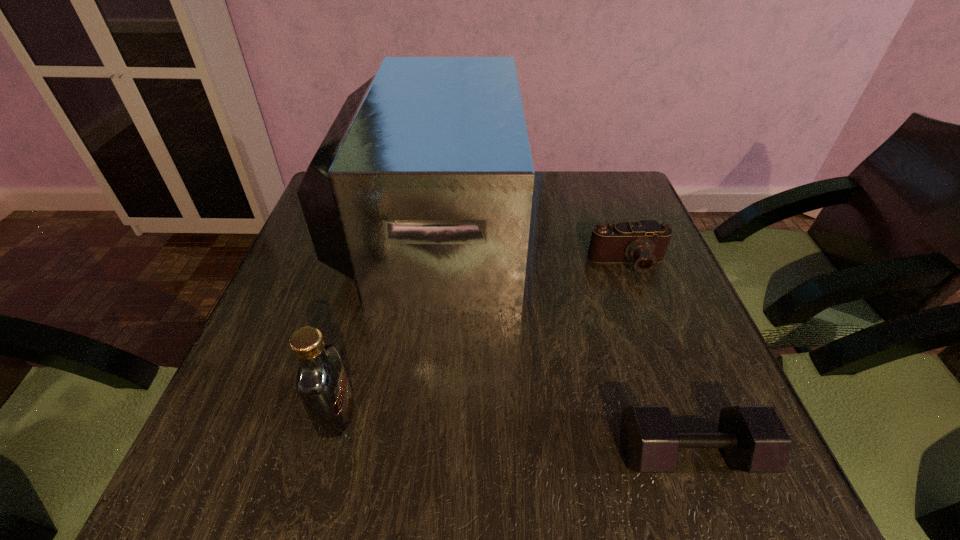
Identify the location of microwave oven. (421, 192).

You are a GUI agent. You are given a task and a screenshot of the screen. Output one action in this format:
    pyautogui.click(x=<x>, y=<y>)
    Task: Click on the third shortest object
    Image resolution: width=960 pixels, height=540 pixels.
    Given the screenshot: What is the action you would take?
    pyautogui.click(x=322, y=384)

At what (x,y) coordinates should I click in order to perform the action: click on dumbbell. Please return your answer as a coordinate pair (x, y). This screenshot has width=960, height=540. Looking at the image, I should click on (753, 439).

At what (x,y) coordinates should I click in order to perform the action: click on camera. Please return your answer as a coordinate pair (x, y). The height and width of the screenshot is (540, 960). Looking at the image, I should click on (644, 242).

Where is `vacant space located on the front-facing side of the tallest object`? vacant space located on the front-facing side of the tallest object is located at coordinates (545, 228).

Find the location of a particular element. The width and height of the screenshot is (960, 540). vacant space located on the front-facing side of the vodka is located at coordinates (490, 414).

The width and height of the screenshot is (960, 540). I want to click on free location located on the left of the dumbbell, so click(477, 454).

Identify the location of vacant area situated on the front-facing side of the camera. (662, 355).

Where is `object located in the far edge section of the desktop`? object located in the far edge section of the desktop is located at coordinates (421, 192).

Where is `object at the near edge`? The height and width of the screenshot is (540, 960). object at the near edge is located at coordinates (753, 439).